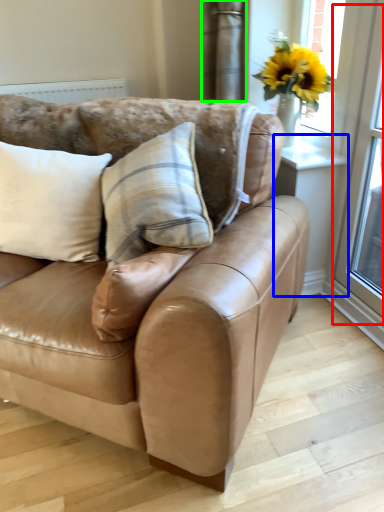
Question: Which object is the farthest from screen door (highlighted by a red box)? Choose among these: window (highlighted by a blue box) or curtain (highlighted by a green box).

Choices:
 (A) window
 (B) curtain

Answer: (B)